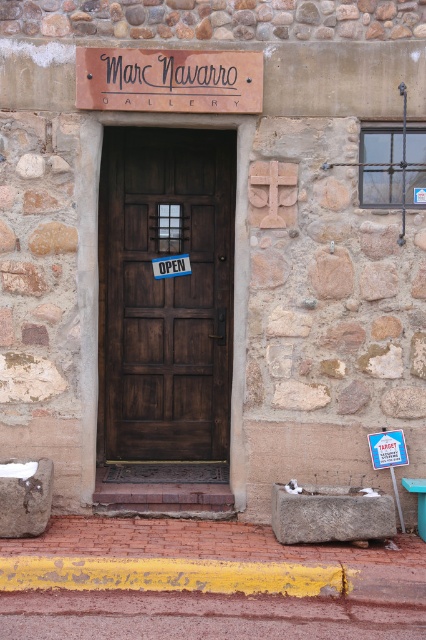
Question: Considering the real-world distances, which object is closest to the wooden sign at center?

Choices:
 (A) blue paper sign at door center
 (B) blue plastic sign at lower right
 (C) dark wood door at center

Answer: (C)

Question: Which of the following is the farthest from the observer?

Choices:
 (A) wooden sign at center
 (B) blue plastic sign at lower right
 (C) dark wood door at center
 (D) blue paper sign at door center

Answer: (D)

Question: Is wooden sign at center smaller than white paper sign at center?

Choices:
 (A) no
 (B) yes

Answer: (A)

Question: Which of the following is the farthest from the observer?

Choices:
 (A) wooden sign at center
 (B) rusty metal curb at lower center
 (C) white paper sign at center

Answer: (C)

Question: Does dark wood door at center have a smaller size compared to blue paper sign at door center?

Choices:
 (A) no
 (B) yes

Answer: (A)

Question: Where is wooden sign at center located in relation to rusty metal curb at lower center in the image?

Choices:
 (A) below
 (B) above

Answer: (B)